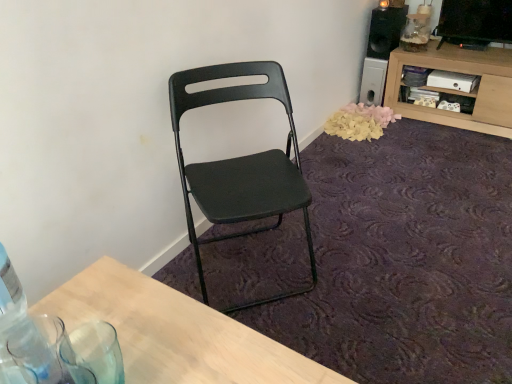
The height and width of the screenshot is (384, 512). I want to click on vacant area situated below matte black folding chair at center (from a real-world perspective), so click(251, 270).